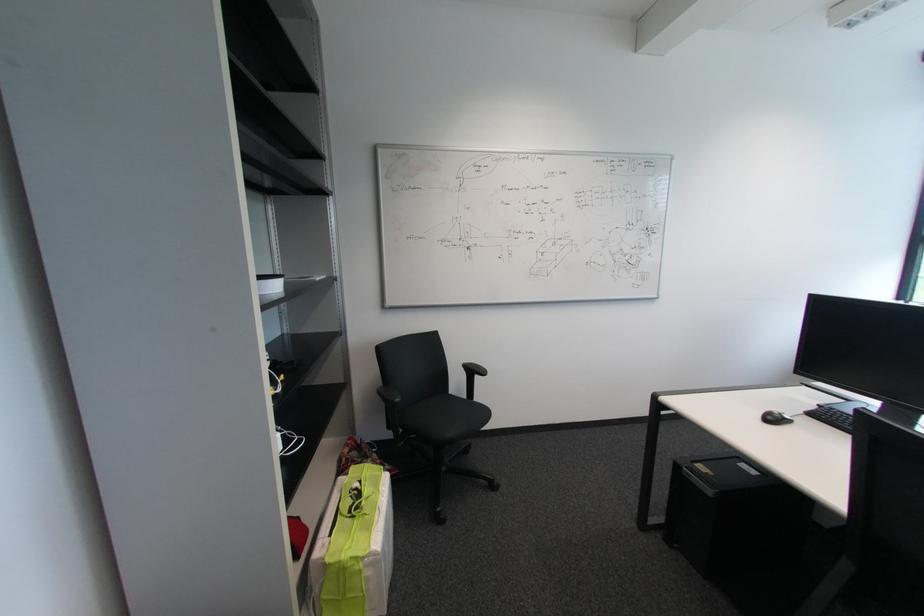
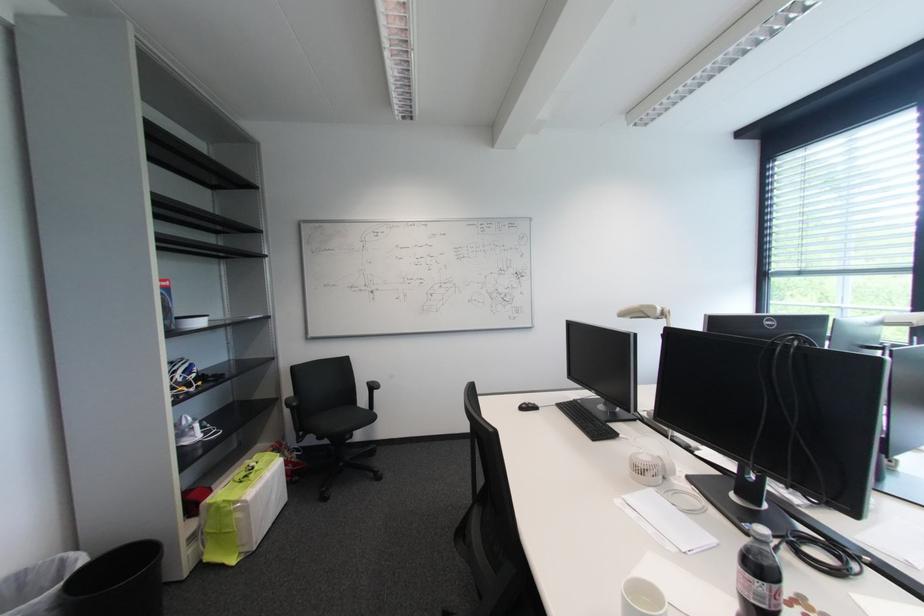
Find the pixel in the second image that matches point (775, 418) in the first image.

(530, 408)